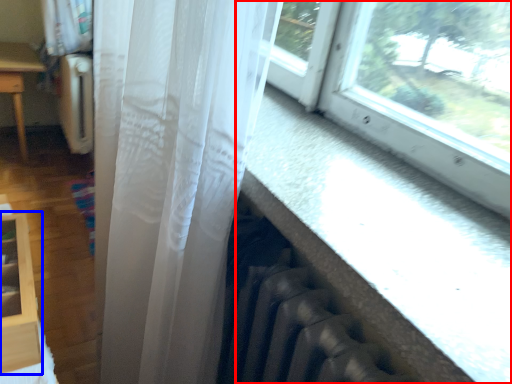
Question: Which of the following is the farthest to the observer, window (highlighted by a red box) or shelf (highlighted by a blue box)?

Choices:
 (A) window
 (B) shelf

Answer: (B)